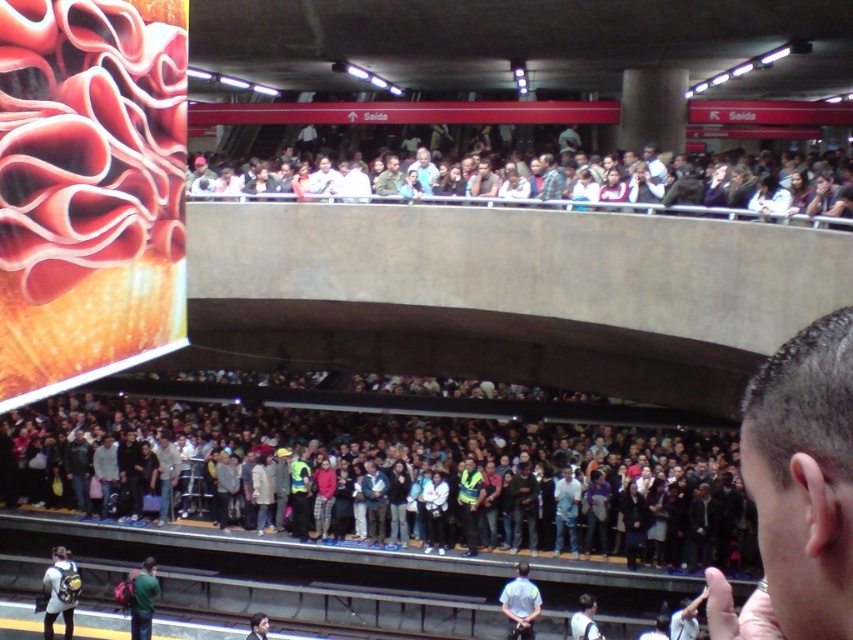
Question: Which object is closer to the camera taking this photo?

Choices:
 (A) multicolored casual clothing at upper center
 (B) red flannel shirt at lower center

Answer: (A)

Question: Is dark brown hair at lower right positioned at the back of light blue uniform at lower center?

Choices:
 (A) yes
 (B) no

Answer: (B)

Question: Where is multicolored casual clothing at upper center located in relation to light blue uniform at lower center in the image?

Choices:
 (A) right
 (B) left

Answer: (A)

Question: Which object appears closest to the camera in this image?

Choices:
 (A) dark gray shirt at upper center
 (B) light blue shirt at upper center
 (C) multicolored casual clothing at upper center

Answer: (C)

Question: Can you confirm if multicolored casual clothing at upper center is thinner than light blue uniform at lower center?

Choices:
 (A) yes
 (B) no

Answer: (B)

Question: Which object is farther from the camera taking this photo?

Choices:
 (A) light blue shirt at upper center
 (B) dark gray shirt at upper center
 (C) dark gray concrete crowd at lower center
 (D) red flannel shirt at lower center

Answer: (A)